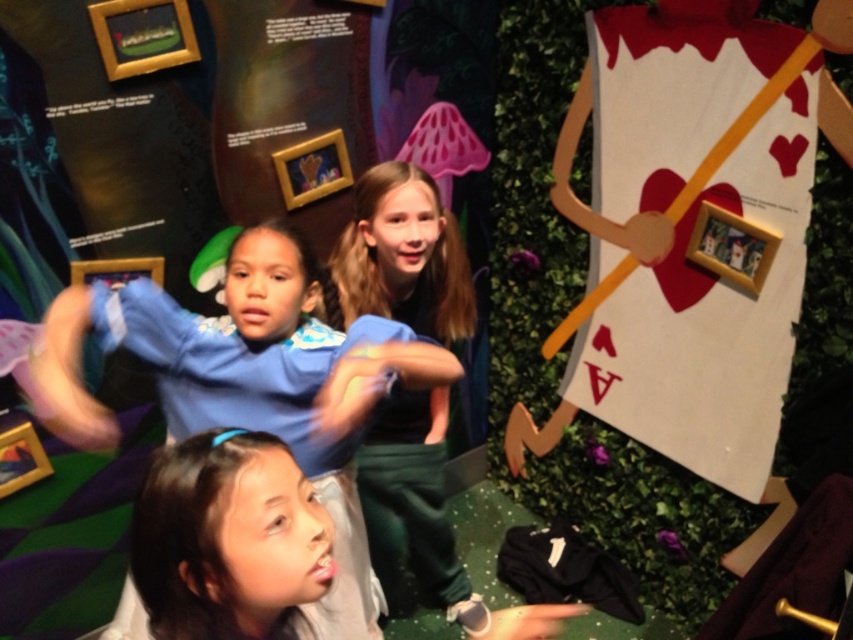
Question: Does white cardboard heart at right appear under gold wooden picture frame at upper right?

Choices:
 (A) yes
 (B) no

Answer: (A)

Question: Which point is farther to the camera?

Choices:
 (A) blue fleece jacket at center
 (B) gold wooden picture frame at upper left

Answer: (B)

Question: Which point is closer to the camera?

Choices:
 (A) blue denim jeans at center
 (B) blue fleece jacket at center

Answer: (B)

Question: Which object is closer to the camera taking this photo?

Choices:
 (A) metallic gold picture frame at upper center
 (B) gold wooden picture frame at upper right
 (C) woodenobject at upper center

Answer: (A)

Question: Is woodenobject at upper center positioned before metallic gold picture frame at upper center?

Choices:
 (A) yes
 (B) no

Answer: (B)

Question: Is white cardboard heart at right above gold wooden picture frame at upper right?

Choices:
 (A) yes
 (B) no

Answer: (B)